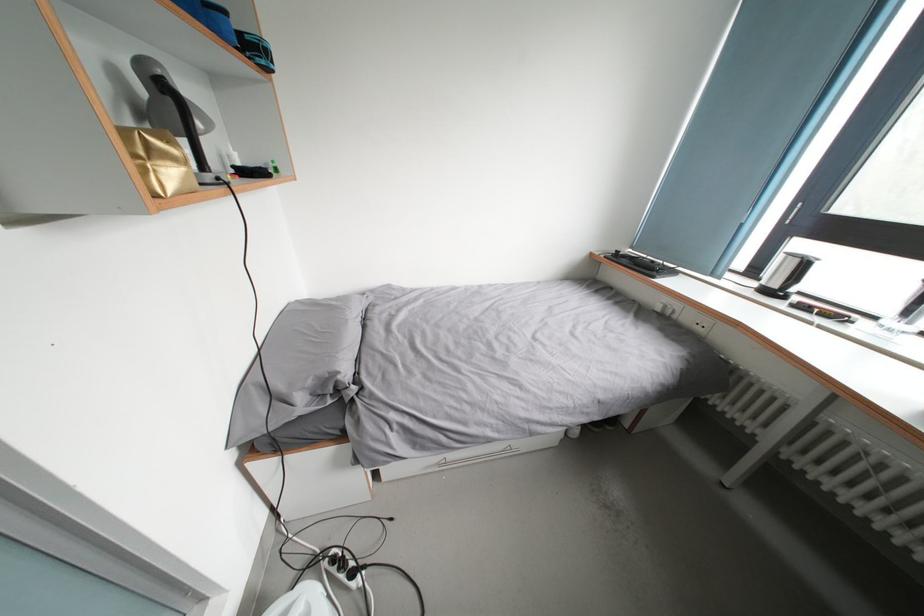
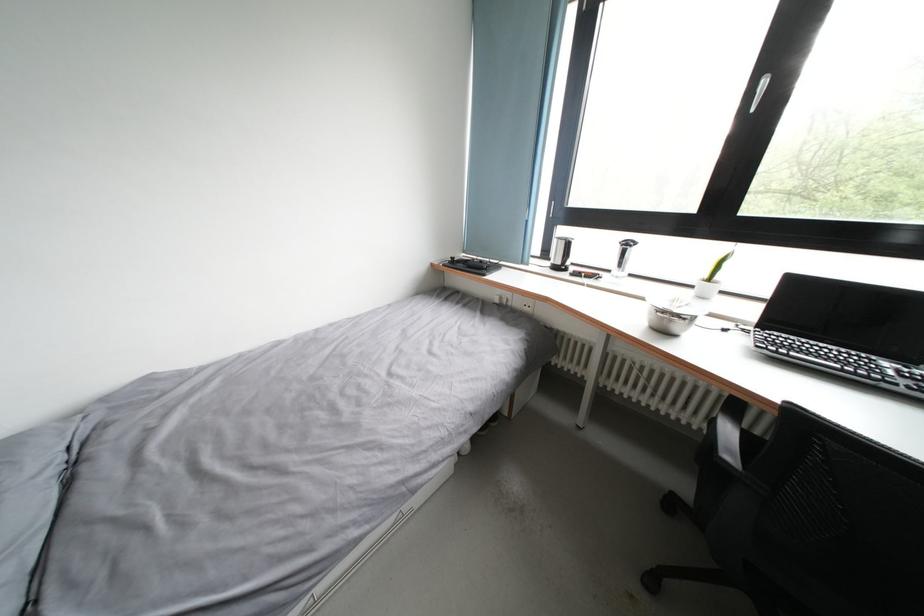
Question: The images are taken continuously from a first-person perspective. In which direction is your viewpoint rotating?

Choices:
 (A) Left
 (B) Right
 (C) Up
 (D) Down

Answer: (B)